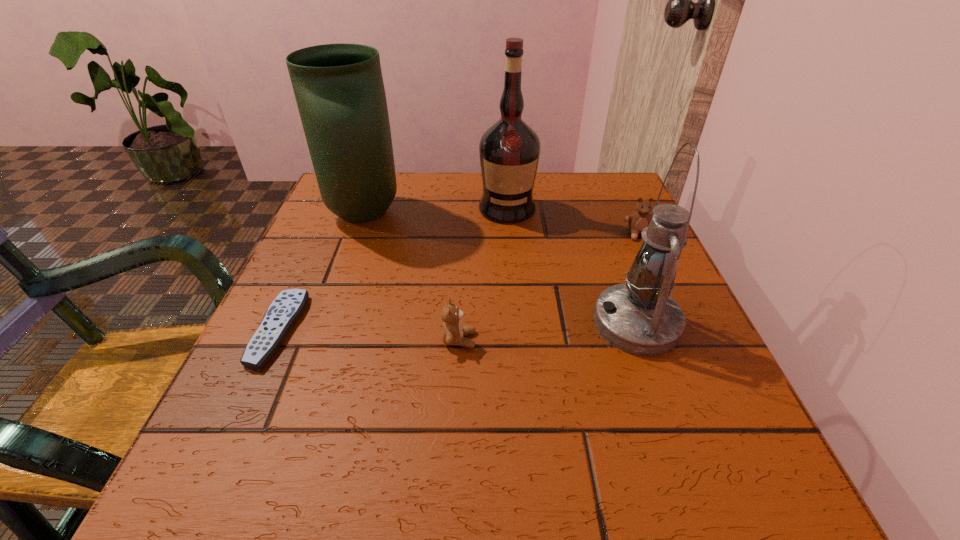
Where is `liquor`? This screenshot has height=540, width=960. liquor is located at coordinates (509, 151).

You are a GUI agent. You are given a task and a screenshot of the screen. Output one action in this format:
    pyautogui.click(x=<x>, y=<y>)
    Task: Click on the vase
    This screenshot has width=960, height=540.
    Given the screenshot: What is the action you would take?
    pyautogui.click(x=339, y=89)

This screenshot has width=960, height=540. I want to click on oil lamp, so click(639, 317).

At what (x,y) coordinates should I click in order to perform the action: click on the fourth object from right to left. Please return your answer as a coordinate pair (x, y). This screenshot has width=960, height=540. Looking at the image, I should click on (453, 333).

Where is `the left teddy bear`? the left teddy bear is located at coordinates (453, 333).

At what (x,y) coordinates should I click in order to perform the action: click on the farther teddy bear. Please return your answer as a coordinate pair (x, y). Image resolution: width=960 pixels, height=540 pixels. Looking at the image, I should click on [640, 219].

Find the location of a particular element. remote control is located at coordinates (287, 307).

This screenshot has width=960, height=540. Find the location of `free region located 0.180m on the surface of the third object from right to left`. free region located 0.180m on the surface of the third object from right to left is located at coordinates (513, 279).

The height and width of the screenshot is (540, 960). Find the location of `free region located 0.050m on the back of the vase`. free region located 0.050m on the back of the vase is located at coordinates (377, 179).

The image size is (960, 540). I want to click on blank space located 0.300m on the left of the oil lamp, so click(417, 323).